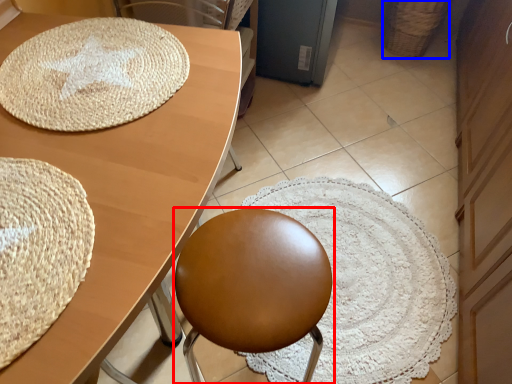
Question: Which object is closer to the camera taking this photo, chair (highlighted by a red box) or basket (highlighted by a blue box)?

Choices:
 (A) chair
 (B) basket

Answer: (A)